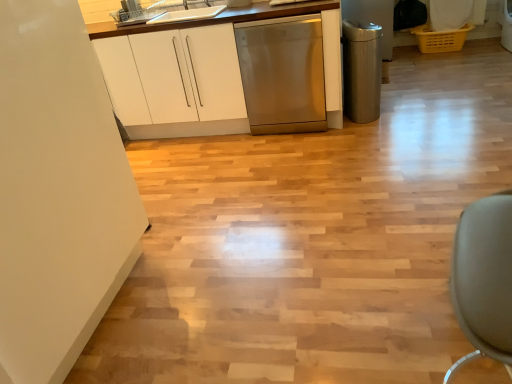
Question: From a real-world perspective, is white glossy sink at upper center over stainless steel dishwasher at center?

Choices:
 (A) yes
 (B) no

Answer: (A)

Question: Considering the relative positions of white glossy sink at upper center and stainless steel dishwasher at center in the image provided, is white glossy sink at upper center to the left of stainless steel dishwasher at center from the viewer's perspective?

Choices:
 (A) yes
 (B) no

Answer: (A)

Question: Is white glossy sink at upper center further to camera compared to stainless steel dishwasher at center?

Choices:
 (A) no
 (B) yes

Answer: (B)

Question: Is stainless steel dishwasher at center at the back of white glossy sink at upper center?

Choices:
 (A) yes
 (B) no

Answer: (B)

Question: Does white glossy sink at upper center turn towards stainless steel dishwasher at center?

Choices:
 (A) no
 (B) yes

Answer: (A)

Question: Can you confirm if white glossy sink at upper center is taller than stainless steel dishwasher at center?

Choices:
 (A) no
 (B) yes

Answer: (A)

Question: Considering the relative positions of stainless steel dishwasher at center and polished stainless steel trash can at right, which appears as the 2th appliance when viewed from the top, in the image provided, is stainless steel dishwasher at center to the left of polished stainless steel trash can at right, which appears as the 2th appliance when viewed from the top, from the viewer's perspective?

Choices:
 (A) yes
 (B) no

Answer: (A)

Question: Does stainless steel dishwasher at center come in front of polished stainless steel trash can at right, the first appliance viewed from the right?

Choices:
 (A) yes
 (B) no

Answer: (A)

Question: From the image's perspective, is stainless steel dishwasher at center on polished stainless steel trash can at right, the second appliance positioned from the left?

Choices:
 (A) no
 (B) yes

Answer: (B)

Question: Is stainless steel dishwasher at center surrounding polished stainless steel trash can at right, the second appliance positioned from the left?

Choices:
 (A) yes
 (B) no

Answer: (B)

Question: Is stainless steel dishwasher at center positioned with its back to polished stainless steel trash can at right, which appears as the 2th appliance when viewed from the top?

Choices:
 (A) yes
 (B) no

Answer: (B)

Question: Does stainless steel dishwasher at center have a greater width compared to polished stainless steel trash can at right, which appears as the 2th appliance when viewed from the top?

Choices:
 (A) yes
 (B) no

Answer: (A)

Question: From a real-world perspective, is polished stainless steel trash can at right, the second appliance positioned from the left, on white glossy sink at upper center?

Choices:
 (A) no
 (B) yes

Answer: (A)